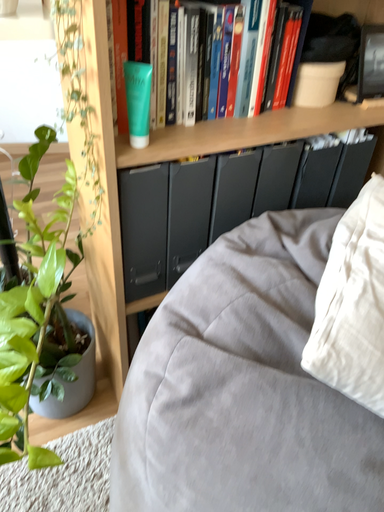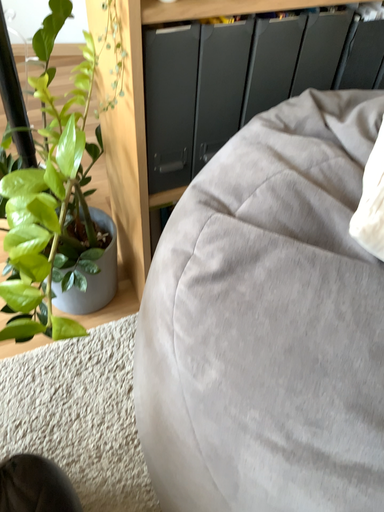
Question: Which way did the camera rotate in the video?

Choices:
 (A) rotated downward
 (B) rotated upward

Answer: (A)